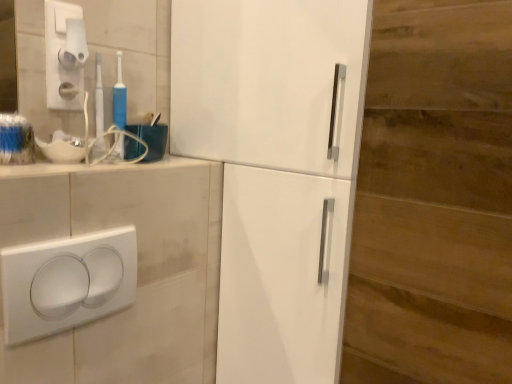
Question: Considering the positions of white plastic light switch at upper left, the first light switch viewed from the back, and beige ceramic counter top at upper left in the image, is white plastic light switch at upper left, the first light switch viewed from the back, bigger or smaller than beige ceramic counter top at upper left?

Choices:
 (A) small
 (B) big

Answer: (A)

Question: Visually, is white plastic light switch at upper left, marked as the 2th light switch in a front-to-back arrangement, positioned to the left or to the right of beige ceramic counter top at upper left?

Choices:
 (A) right
 (B) left

Answer: (B)

Question: Estimate the real-world distances between objects in this image. Which object is farther from the white plastic toothbrush at upper left, arranged as the 2th toothbrush when viewed from the right?

Choices:
 (A) white plastic/light switch at lower left, which ranks as the second light switch in back-to-front order
 (B) white plastic light switch at upper left, arranged as the 1th light switch when viewed from the top
 (C) white glossy cabinet at center
 (D) beige ceramic counter top at upper left
 (E) blue plastic toothbrush at upper left, the 1th toothbrush from the right

Answer: (C)

Question: Considering the real-world distances, which object is closest to the white plastic/light switch at lower left, acting as the 1th light switch starting from the bottom?

Choices:
 (A) white plastic light switch at upper left, the first light switch viewed from the back
 (B) blue plastic toothbrush at upper left, the 1th toothbrush from the right
 (C) white plastic toothbrush at upper left, the 1th toothbrush viewed from the left
 (D) white glossy cabinet at center
 (E) beige ceramic counter top at upper left

Answer: (E)